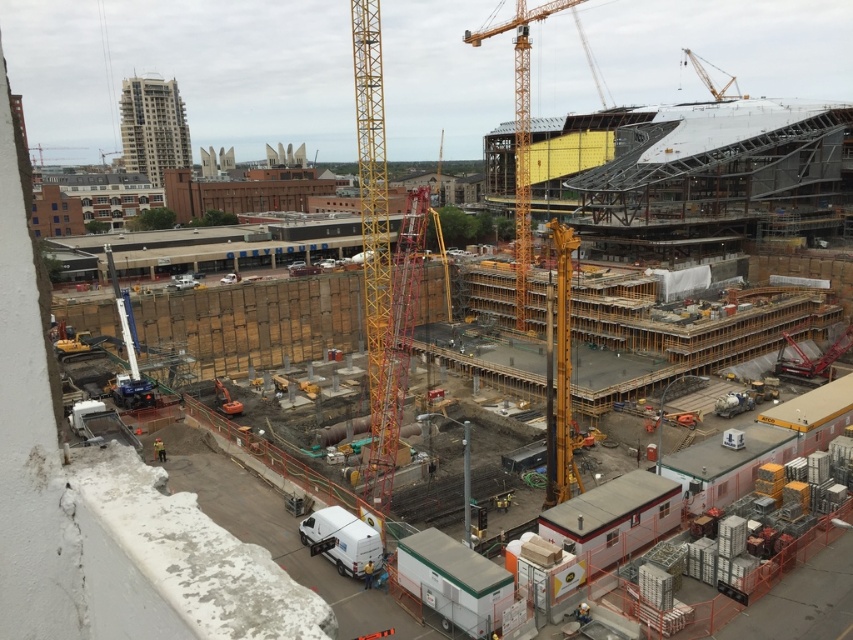
In the scene shown: You are a delivery driver who needs to park your truck near the construction site. You see the yellow metallic crane at center and the white matte van at lower center. Which object should you avoid parking next to if you want to stay as far left as possible?

You should avoid parking next to the yellow metallic crane at center because it is to the right of the white matte van at lower center, meaning the crane is further to the right side of the scene. Parking near the white matte van at lower center would keep you closer to the left side.

You are a construction worker standing at the entrance of the construction site. You need to move a heavy beam to the yellow metallic crane at center. Which direction should you move the beam to reach the crane?

The yellow metallic crane at center is located at point (521, 132), so you should move the beam towards the center of the site to reach the crane.